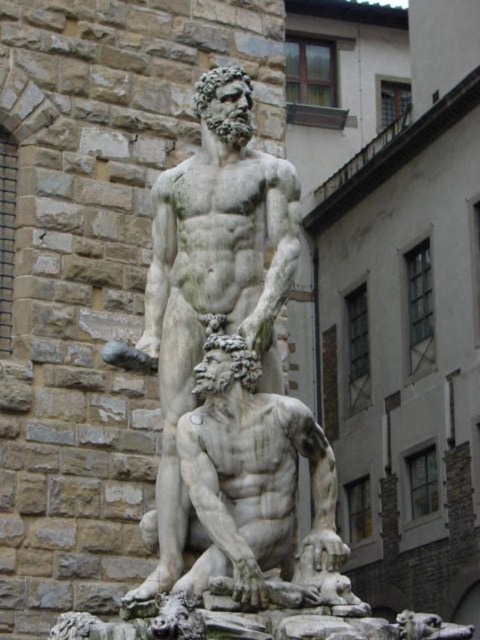
Can you confirm if white marble statue at center is taller than white marble statue at lower center?

Yes.

Between point (139, 595) and point (190, 532), which one is positioned behind?

Point (190, 532)

Does point (179, 188) lie in front of point (217, 320)?

No, it is behind (217, 320).

The image size is (480, 640). I want to click on white marble statue at center, so click(x=213, y=276).